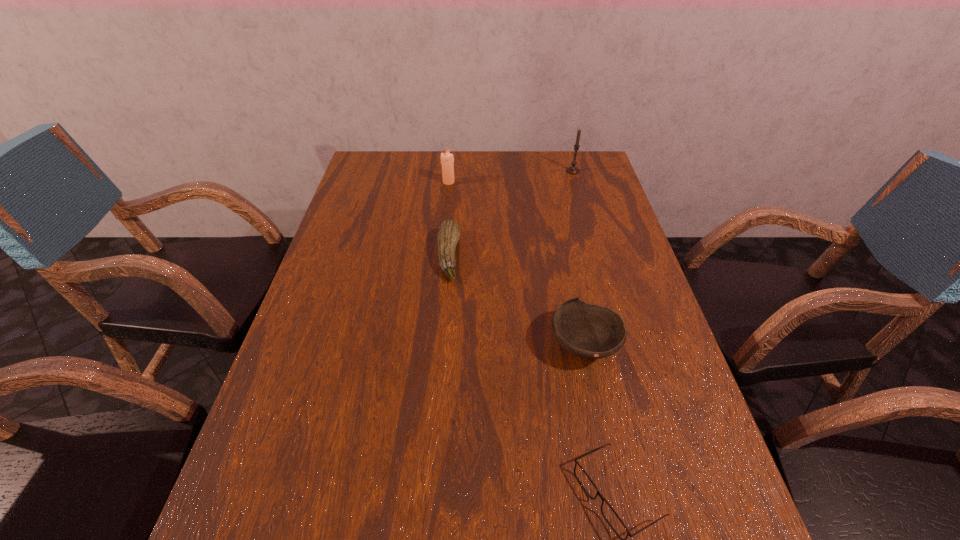
I want to click on the tallest object, so click(571, 170).

At what (x,y) coordinates should I click in order to perform the action: click on the right candle. Please return your answer as a coordinate pair (x, y). This screenshot has width=960, height=540. Looking at the image, I should click on (571, 170).

Identify the location of the shorter candle. Image resolution: width=960 pixels, height=540 pixels. (447, 160).

The width and height of the screenshot is (960, 540). Find the location of `the left candle`. the left candle is located at coordinates (447, 160).

Where is `the second nearest object`? The image size is (960, 540). the second nearest object is located at coordinates (589, 331).

Where is `bowl`? This screenshot has width=960, height=540. bowl is located at coordinates (589, 331).

This screenshot has width=960, height=540. In order to click on zucchini in this screenshot , I will do `click(449, 231)`.

Locate an element on the screen. The image size is (960, 540). the third nearest object is located at coordinates (449, 231).

Locate an element on the screen. This screenshot has width=960, height=540. free point located on the left of the right candle is located at coordinates (515, 171).

I want to click on vacant space located on the back of the shorter candle, so click(x=451, y=151).